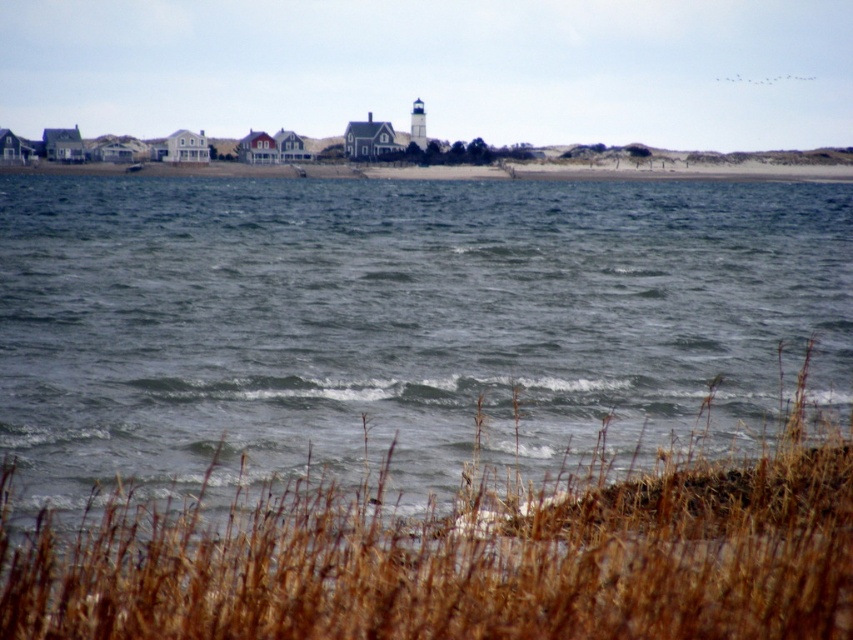
Can you confirm if gray water at center is taller than brown grass at lower center?

Yes.

Does gray water at center appear on the left side of brown grass at lower center?

Correct, you'll find gray water at center to the left of brown grass at lower center.

Which is in front, point (488, 216) or point (68, 556)?

Point (68, 556)

Locate an element on the screen. This screenshot has height=640, width=853. gray water at center is located at coordinates (399, 323).